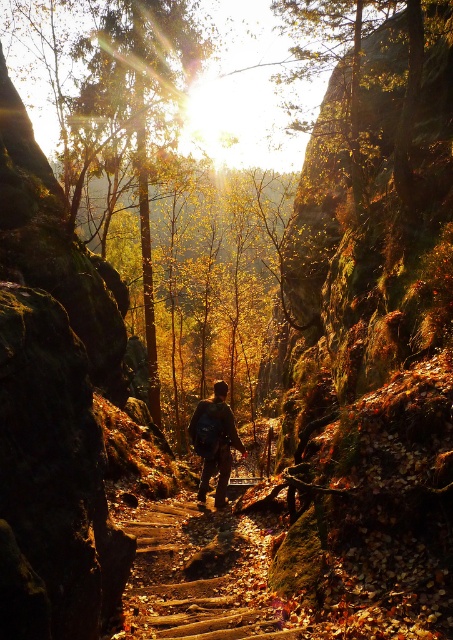
Is brown wooden trail at center shorter than camouflage backpack at center?

Yes.

Between point (187, 596) and point (212, 468), which one is positioned behind?

The point (212, 468) is more distant.

Identify the location of brown wooden trail at center. The height and width of the screenshot is (640, 453). (198, 576).

Where is `green mossy rock at center`? green mossy rock at center is located at coordinates (372, 337).

Does green mossy rock at center have a smaller size compared to camouflage backpack at center?

Incorrect, green mossy rock at center is not smaller in size than camouflage backpack at center.

Is point (434, 72) farther from camera compared to point (200, 452)?

Yes, it is.

Locate an element on the screen. green mossy rock at center is located at coordinates (372, 337).

Is green mossy rock at center above brown wooden trail at center?

Correct, green mossy rock at center is located above brown wooden trail at center.

Does green mossy rock at center appear on the left side of brown wooden trail at center?

In fact, green mossy rock at center is to the right of brown wooden trail at center.

Find the location of a particular element. The image size is (453, 640). green mossy rock at center is located at coordinates (372, 337).